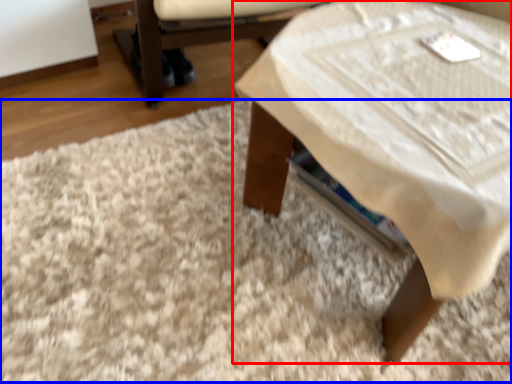
Question: Among these objects, which one is farthest to the camera, table (highlighted by a red box) or mat (highlighted by a blue box)?

Choices:
 (A) table
 (B) mat

Answer: (B)